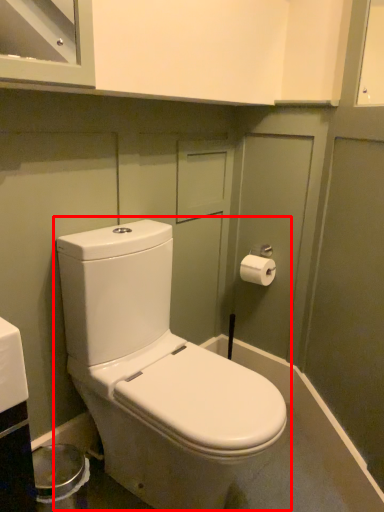
Question: Considering the relative positions of toilet (annotated by the red box) and toilet paper in the image provided, where is toilet (annotated by the red box) located with respect to the staircase?

Choices:
 (A) left
 (B) right

Answer: (A)